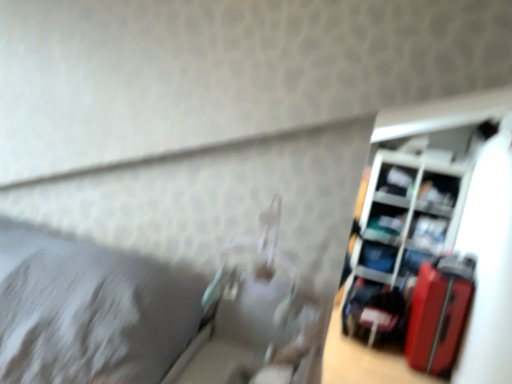
Question: Can you confirm if shiny red suitcase at right is shorter than matte plastic shelf at upper right, placed as the 3th shelf when sorted from top to bottom?

Choices:
 (A) yes
 (B) no

Answer: (B)

Question: Considering the relative positions of shiny red suitcase at right and matte plastic shelf at upper right, placed as the 3th shelf when sorted from top to bottom, in the image provided, is shiny red suitcase at right to the right of matte plastic shelf at upper right, placed as the 3th shelf when sorted from top to bottom, from the viewer's perspective?

Choices:
 (A) no
 (B) yes

Answer: (A)

Question: From a real-world perspective, does shiny red suitcase at right sit lower than matte plastic shelf at upper right, placed as the 3th shelf when sorted from top to bottom?

Choices:
 (A) no
 (B) yes

Answer: (B)

Question: Is shiny red suitcase at right next to matte plastic shelf at upper right, the third shelf from the bottom, and touching it?

Choices:
 (A) yes
 (B) no

Answer: (B)

Question: Is shiny red suitcase at right taller than matte plastic shelf at upper right, placed as the 3th shelf when sorted from top to bottom?

Choices:
 (A) yes
 (B) no

Answer: (A)

Question: Is shiny red suitcase at right facing away from matte plastic shelf at upper right, placed as the 3th shelf when sorted from top to bottom?

Choices:
 (A) no
 (B) yes

Answer: (A)

Question: Considering the relative sizes of matte black laptop at right, the 5th shelf in the top-to-bottom sequence, and matte black shelf at upper right, the fourth shelf when ordered from bottom to top, in the image provided, is matte black laptop at right, the 5th shelf in the top-to-bottom sequence, smaller than matte black shelf at upper right, the fourth shelf when ordered from bottom to top,?

Choices:
 (A) yes
 (B) no

Answer: (A)

Question: Is matte black laptop at right, the 5th shelf in the top-to-bottom sequence, thinner than matte black shelf at upper right, the fourth shelf when ordered from bottom to top?

Choices:
 (A) yes
 (B) no

Answer: (A)

Question: From a real-world perspective, is matte black laptop at right, the 5th shelf in the top-to-bottom sequence, on matte black shelf at upper right, the fourth shelf when ordered from bottom to top?

Choices:
 (A) yes
 (B) no

Answer: (B)

Question: Can you confirm if matte black laptop at right, the 5th shelf in the top-to-bottom sequence, is positioned to the right of matte black shelf at upper right, the second shelf in the top-to-bottom sequence?

Choices:
 (A) no
 (B) yes

Answer: (A)

Question: Is matte black laptop at right, the 5th shelf in the top-to-bottom sequence, aimed at matte black shelf at upper right, the fourth shelf when ordered from bottom to top?

Choices:
 (A) no
 (B) yes

Answer: (A)

Question: Would you say matte black laptop at right, the 5th shelf in the top-to-bottom sequence, contains matte black shelf at upper right, the fourth shelf when ordered from bottom to top?

Choices:
 (A) no
 (B) yes

Answer: (A)

Question: From a real-world perspective, is matte plastic shelf at upper right, placed as the 3th shelf when sorted from top to bottom, located beneath matte black laptop at right, which is the 1th shelf in bottom-to-top order?

Choices:
 (A) no
 (B) yes

Answer: (A)